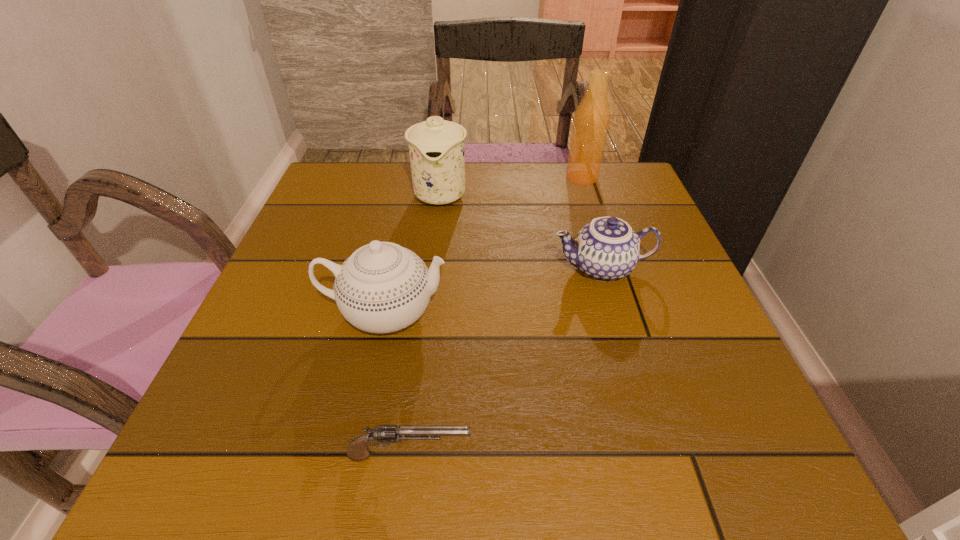
Find the location of a particular element. Image resolution: width=960 pixels, height=540 pixels. vacant position located 0.240m on the spout of the third tallest object is located at coordinates (580, 313).

Find the location of a particular element. This screenshot has height=540, width=960. free spot located 0.110m from the spout of the rightmost chinaware is located at coordinates (496, 268).

The image size is (960, 540). What are the coordinates of `free space located from the spout of the rightmost chinaware` in the screenshot? It's located at (422, 268).

You are a GUI agent. You are given a task and a screenshot of the screen. Output one action in this format:
    pyautogui.click(x=<x>, y=<y>)
    Task: Click on the vacant region located 0.070m from the spout of the rightmost chinaware
    
    Given the screenshot: What is the action you would take?
    pyautogui.click(x=516, y=268)

I want to click on free space located 0.170m aiming along the barrel of the gun, so click(594, 455).

Image resolution: width=960 pixels, height=540 pixels. Identify the location of beer bottle present at the far edge. (591, 121).

This screenshot has width=960, height=540. Identify the location of chinaware located at the far edge. (436, 147).

Image resolution: width=960 pixels, height=540 pixels. Identify the location of object positioned at the near edge. (383, 435).

Where is `object that is at the left edge`? This screenshot has height=540, width=960. object that is at the left edge is located at coordinates (382, 287).

Find the location of a particular element. beer bottle that is positioned at the right edge is located at coordinates (591, 121).